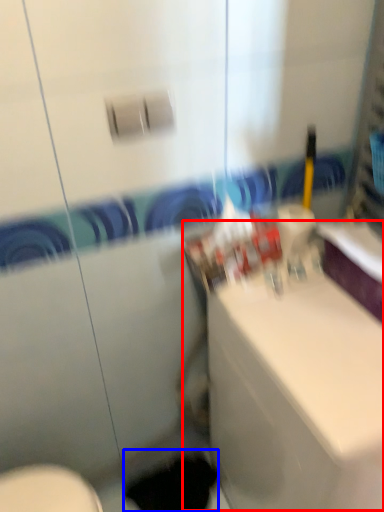
Question: Which object appears farthest to the camera in this image, counter top (highlighted by a red box) or hole (highlighted by a blue box)?

Choices:
 (A) counter top
 (B) hole

Answer: (B)